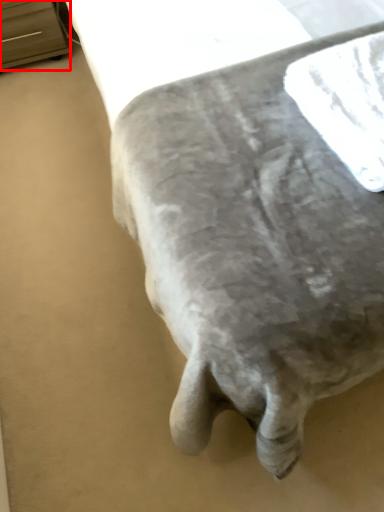
Question: Considering the relative positions of furniture (annotated by the red box) and linen in the image provided, where is furniture (annotated by the red box) located with respect to the staircase?

Choices:
 (A) right
 (B) left

Answer: (B)